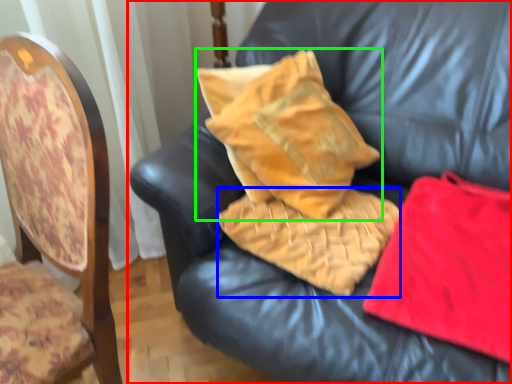
Question: Considering the real-world distances, which object is farthest from furniture (highlighted by a red box)? material (highlighted by a blue box) or pillow (highlighted by a green box)?

Choices:
 (A) material
 (B) pillow

Answer: (A)